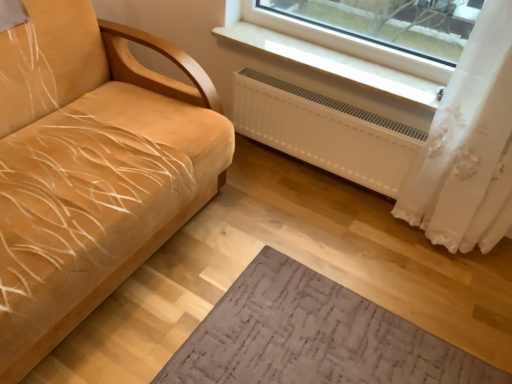
Describe the element at coordinates (468, 146) in the screenshot. I see `white sheer curtain at right` at that location.

At what (x,y) coordinates should I click in order to perform the action: click on velvet yellow couch at left. Please return your answer as a coordinate pair (x, y). The height and width of the screenshot is (384, 512). Looking at the image, I should click on (91, 168).

Identify the location of white plastic radiator at upper center. Image resolution: width=512 pixels, height=384 pixels. [x=339, y=54].

Considering the positions of objects velvet yellow couch at left and white sheer curtain at right in the image provided, who is more to the left, velvet yellow couch at left or white sheer curtain at right?

velvet yellow couch at left.

Considering the positions of objects velvet yellow couch at left and white sheer curtain at right in the image provided, who is in front, velvet yellow couch at left or white sheer curtain at right?

velvet yellow couch at left is closer to the camera.

Is velvet yellow couch at left completely or partially outside of white sheer curtain at right?

velvet yellow couch at left lies outside white sheer curtain at right's area.

Which is nearer, (148, 38) or (404, 205)?

Point (148, 38) appears to be closer to the viewer than point (404, 205).

Who is taller, white plastic radiator at upper center or white sheer curtain at right?

white sheer curtain at right.

From the picture: Which is more to the left, white plastic radiator at upper center or white sheer curtain at right?

Positioned to the left is white plastic radiator at upper center.

Is white plastic radiator at upper center positioned far away from white sheer curtain at right?

No, white plastic radiator at upper center is not far from white sheer curtain at right.

From the image's perspective, would you say white plastic radiator at upper center is shown under white sheer curtain at right?

No.

Is velvet yellow couch at left to the left of white plastic radiator at upper center from the viewer's perspective?

Correct, you'll find velvet yellow couch at left to the left of white plastic radiator at upper center.

Locate an element on the screen. The image size is (512, 384). studio couch in front of the white plastic radiator at upper center is located at coordinates (91, 168).

From the image's perspective, is velvet yellow couch at left located above or below white plastic radiator at upper center?

velvet yellow couch at left is situated lower than white plastic radiator at upper center in the image.

At what (x,y) coordinates should I click in order to perform the action: click on studio couch located in front of the white sheer curtain at right. Please return your answer as a coordinate pair (x, y). This screenshot has height=384, width=512. Looking at the image, I should click on (91, 168).

From a real-world perspective, is white sheer curtain at right positioned over velvet yellow couch at left based on gravity?

Indeed, from a real-world perspective, white sheer curtain at right stands above velvet yellow couch at left.

Could you tell me if white sheer curtain at right is turned towards velvet yellow couch at left?

No, white sheer curtain at right is not oriented towards velvet yellow couch at left.

Between white sheer curtain at right and velvet yellow couch at left, which one is positioned behind?

Positioned behind is white sheer curtain at right.

Considering the sizes of objects white plastic radiator at upper center and velvet yellow couch at left in the image provided, who is taller, white plastic radiator at upper center or velvet yellow couch at left?

velvet yellow couch at left is taller.

Which object is closer to the camera, white plastic radiator at upper center or velvet yellow couch at left?

→ velvet yellow couch at left is in front.

Is white plastic radiator at upper center next to velvet yellow couch at left and touching it?

white plastic radiator at upper center is not next to velvet yellow couch at left, and they're not touching.

Is white plastic radiator at upper center looking in the opposite direction of velvet yellow couch at left?

No, white plastic radiator at upper center's orientation is not away from velvet yellow couch at left.

Considering the positions of point (56, 226) and point (305, 95), is point (56, 226) closer or farther from the camera than point (305, 95)?

Point (56, 226).

From a real-world perspective, is velvet yellow couch at left under white matte radiator at lower center?

No.

From the image's perspective, is velvet yellow couch at left on white matte radiator at lower center?

No.

Does velvet yellow couch at left touch white matte radiator at lower center?

No, velvet yellow couch at left is not in contact with white matte radiator at lower center.

At what (x,y) coordinates should I click in order to perform the action: click on window located above the white sheer curtain at right (from the image's perspective). Please return your answer as a coordinate pair (x, y). Looking at the image, I should click on (339, 54).

What's the angular difference between white sheer curtain at right and white plastic radiator at upper center's facing directions?

The facing directions of white sheer curtain at right and white plastic radiator at upper center are 0.582 degrees apart.

Is white sheer curtain at right positioned far away from white plastic radiator at upper center?

No, white sheer curtain at right is not far away from white plastic radiator at upper center.

Find the location of a particular element. curtain on the right of velvet yellow couch at left is located at coordinates (468, 146).

The height and width of the screenshot is (384, 512). Find the location of `window above the white sheer curtain at right (from a real-world perspective)`. window above the white sheer curtain at right (from a real-world perspective) is located at coordinates (339, 54).

Considering their positions, is white plastic radiator at upper center positioned further to white sheer curtain at right than white matte radiator at lower center?

Among the two, white plastic radiator at upper center is located further to white sheer curtain at right.

Estimate the real-world distances between objects in this image. Which object is further from white matte radiator at lower center, white sheer curtain at right or velvet yellow couch at left?

velvet yellow couch at left is further to white matte radiator at lower center.

From the picture: Which object lies nearer to the anchor point white sheer curtain at right, velvet yellow couch at left or white matte radiator at lower center?

white matte radiator at lower center is closer to white sheer curtain at right.

Which object lies nearer to the anchor point white matte radiator at lower center, white plastic radiator at upper center or velvet yellow couch at left?

white plastic radiator at upper center lies closer to white matte radiator at lower center than the other object.

Based on their spatial positions, is velvet yellow couch at left or white plastic radiator at upper center closer to white sheer curtain at right?

white plastic radiator at upper center.

Estimate the real-world distances between objects in this image. Which object is further from velvet yellow couch at left, white matte radiator at lower center or white plastic radiator at upper center?

white plastic radiator at upper center.

Considering their positions, is white matte radiator at lower center positioned further to velvet yellow couch at left than white sheer curtain at right?

white sheer curtain at right is positioned further to the anchor velvet yellow couch at left.

From the image, which object appears to be nearer to white plastic radiator at upper center, white sheer curtain at right or white matte radiator at lower center?

Among the two, white matte radiator at lower center is located nearer to white plastic radiator at upper center.

The image size is (512, 384). Find the location of `window between velvet yellow couch at left and white sheer curtain at right from left to right`. window between velvet yellow couch at left and white sheer curtain at right from left to right is located at coordinates (339, 54).

The width and height of the screenshot is (512, 384). In order to click on window between white sheer curtain at right and white matte radiator at lower center in the front-back direction in this screenshot , I will do `click(339, 54)`.

In order to click on window between velvet yellow couch at left and white matte radiator at lower center along the z-axis in this screenshot , I will do `click(339, 54)`.

Find the location of a particular element. radiator between velvet yellow couch at left and white sheer curtain at right in the horizontal direction is located at coordinates (325, 131).